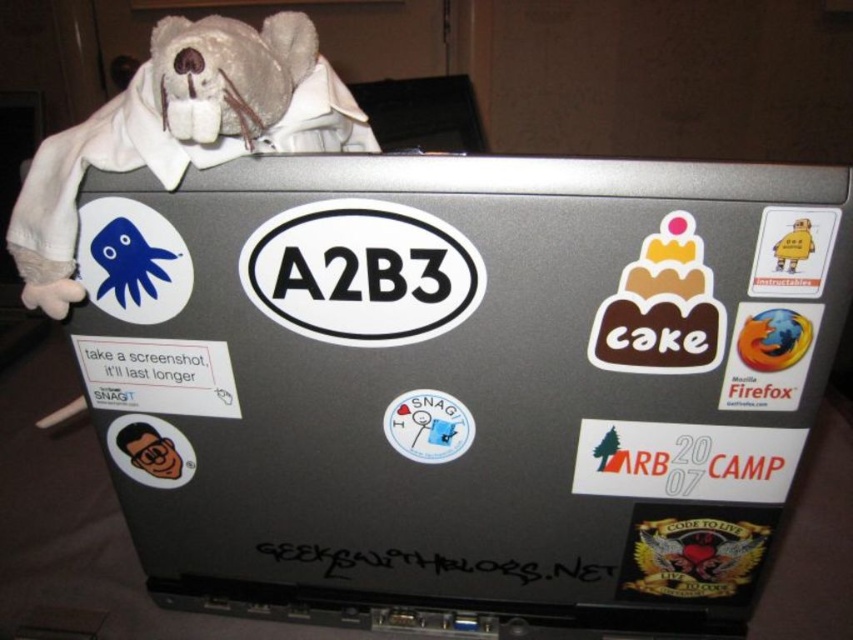
You are trying to locate the firefox sticker at right on the laptop lid. Based on the coordinates provided, where would you find it?

The firefox sticker at right is located at the 2D coordinates point [769,355] on the laptop lid.

You are organizing a sticker collection and want to place the blue matte sticker at upper left and the white paper sticker at center into an album. If the album page has a height limit of 3 cm, which sticker might not fit and why?

The blue matte sticker at upper left might not fit because it is taller than the white paper sticker at center, and the album page has a height limit of 3 cm.

You are trying to locate the firefox sticker at right on the laptop lid. According to the scene description, where is it in relation to the matte plastic face at lower left?

The firefox sticker at right is positioned over the matte plastic face at lower left.